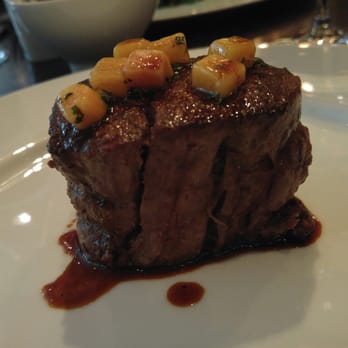
What are the coordinates of `bottom of wine glass` in the screenshot? It's located at (328, 31).